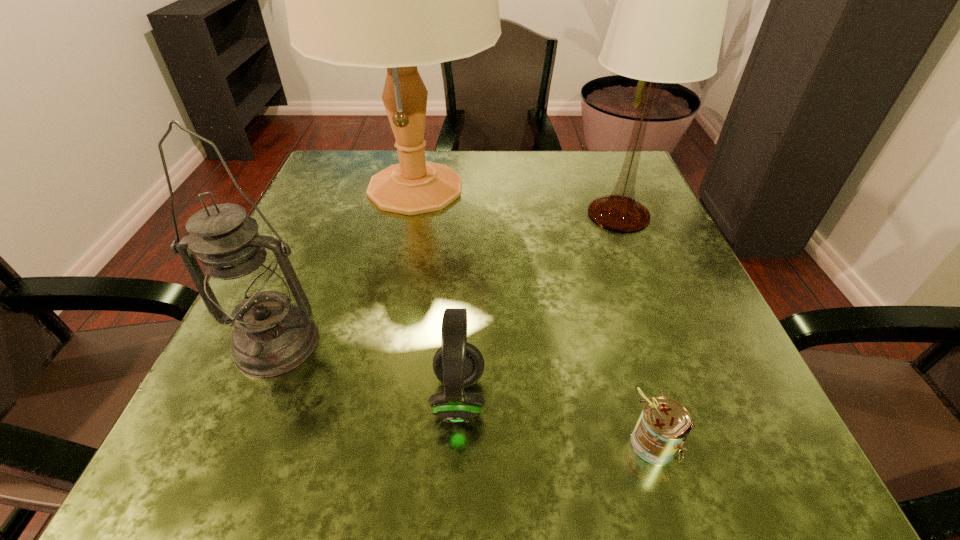
The image size is (960, 540). In order to click on vacant space that is in between the right table lamp and the headset in this screenshot , I will do `click(539, 306)`.

Locate an element on the screen. This screenshot has width=960, height=540. free point between the shorter table lamp and the tallest object is located at coordinates (516, 201).

Locate an element on the screen. The width and height of the screenshot is (960, 540). free space that is in between the third tallest object and the second shortest object is located at coordinates (368, 370).

Locate an element on the screen. vacant area between the third tallest object and the tallest object is located at coordinates (346, 266).

Image resolution: width=960 pixels, height=540 pixels. What are the coordinates of `empty space that is in between the headset and the right table lamp` in the screenshot? It's located at (x=539, y=306).

This screenshot has height=540, width=960. What are the coordinates of `free space between the can and the tallest object` in the screenshot? It's located at (534, 315).

Select which object appears as the second closest to the shortest object. Please provide its 2D coordinates. Your answer should be formatted as a tuple, i.e. [(x, y)], where the tuple contains the x and y coordinates of a point satisfying the conditions above.

[(667, 26)]

Find the location of a particular element. object that is the third closest to the taller table lamp is located at coordinates (457, 364).

Where is `vacant region that satisfies the following two spatial constraints: 1. above the cylindrical shade of the right table lamp; 2. on the ear cups of the fourth tallest object`? The width and height of the screenshot is (960, 540). vacant region that satisfies the following two spatial constraints: 1. above the cylindrical shade of the right table lamp; 2. on the ear cups of the fourth tallest object is located at coordinates (691, 397).